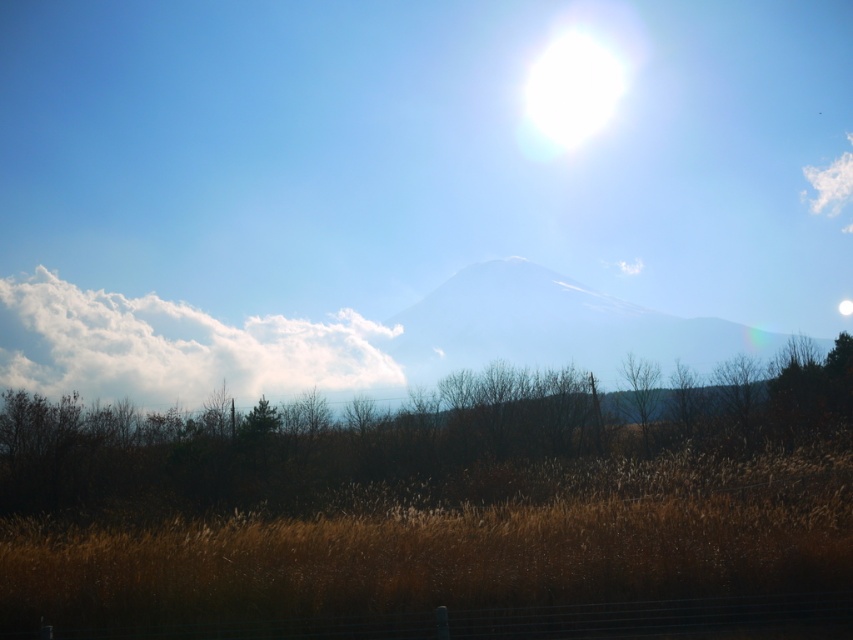
In the scene shown: You are standing in the field of golden grass looking at the mountain. There are two points marked in the image. Which point is closer to you, point (206, 365) or point (26, 292)?

Point (206, 365) is closer to you than point (26, 292).

You are a photographer planning to capture the mountain and its surroundings. Given that the bright white snow at center and the brown dry grass at lower center are both in your frame, which object would appear more dominant in terms of visual size? Please explain based on their sizes.

The bright white snow at center appears more dominant in visual size because it is larger than the brown dry grass at lower center.

You are standing in the field of tall dry grasses in the foreground of the image. You see two points marked on the ground. One is at point (254, 432) and the other at point (843, 228). Which point is closer to you?

Point (254, 432) is in front of point (843, 228), so it is closer to you.